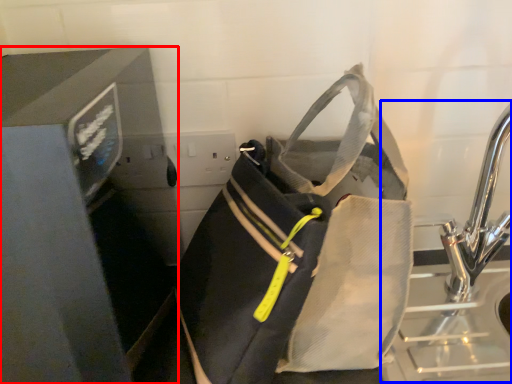
Question: Which object appears farthest to the camera in this image, appliance (highlighted by a red box) or sink (highlighted by a blue box)?

Choices:
 (A) appliance
 (B) sink

Answer: (B)